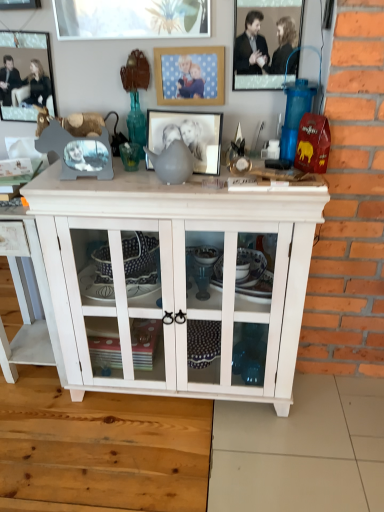
Find the location of `vacant area in front of matte gray picture frame at center, marked as the 3th picture frame in a right-to-left arrangement`. vacant area in front of matte gray picture frame at center, marked as the 3th picture frame in a right-to-left arrangement is located at coordinates (191, 185).